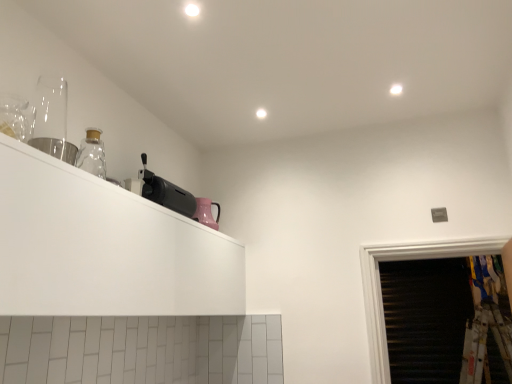
Question: Could you tell me if pink glossy kettle at upper center, which ranks as the 1th appliance in right-to-left order, is facing black plastic toaster at upper left, which is the 2th appliance in front-to-back order?

Choices:
 (A) no
 (B) yes

Answer: (A)

Question: Does pink glossy kettle at upper center, which ranks as the 1th appliance in right-to-left order, contain black plastic toaster at upper left, the second appliance positioned from the back?

Choices:
 (A) no
 (B) yes

Answer: (A)

Question: From the image's perspective, is pink glossy kettle at upper center, the 3th appliance when ordered from left to right, beneath black plastic toaster at upper left, the second appliance positioned from the back?

Choices:
 (A) no
 (B) yes

Answer: (B)

Question: Is pink glossy kettle at upper center, the 3th appliance when ordered from left to right, positioned behind black plastic toaster at upper left, the 2th appliance viewed from the right?

Choices:
 (A) yes
 (B) no

Answer: (A)

Question: From the image's perspective, is pink glossy kettle at upper center, which ranks as the 1th appliance in right-to-left order, above black plastic toaster at upper left, the 2th appliance viewed from the right?

Choices:
 (A) no
 (B) yes

Answer: (A)

Question: Does pink glossy kettle at upper center, the 3th appliance when ordered from left to right, have a lesser width compared to black plastic toaster at upper left, the second appliance positioned from the back?

Choices:
 (A) no
 (B) yes

Answer: (A)

Question: Can you confirm if black plastic toaster at upper left, the second appliance positioned from the back, is positioned to the right of pink glossy kettle at upper center, which ranks as the 1th appliance in right-to-left order?

Choices:
 (A) no
 (B) yes

Answer: (A)

Question: Is black plastic toaster at upper left, which ranks as the 2th appliance in left-to-right order, further to the viewer compared to pink glossy kettle at upper center, which ranks as the 1th appliance in right-to-left order?

Choices:
 (A) yes
 (B) no

Answer: (B)

Question: Does black plastic toaster at upper left, which ranks as the 2th appliance in left-to-right order, have a smaller size compared to pink glossy kettle at upper center, the third appliance from the front?

Choices:
 (A) no
 (B) yes

Answer: (A)

Question: Are black plastic toaster at upper left, the second appliance positioned from the back, and pink glossy kettle at upper center, which ranks as the 1th appliance in right-to-left order, making contact?

Choices:
 (A) no
 (B) yes

Answer: (A)

Question: Considering the relative positions of black plastic toaster at upper left, which is the 2th appliance in front-to-back order, and pink glossy kettle at upper center, the 3th appliance when ordered from left to right, in the image provided, is black plastic toaster at upper left, which is the 2th appliance in front-to-back order, to the left of pink glossy kettle at upper center, the 3th appliance when ordered from left to right, from the viewer's perspective?

Choices:
 (A) yes
 (B) no

Answer: (A)

Question: Can you confirm if black plastic toaster at upper left, which ranks as the 2th appliance in left-to-right order, is thinner than pink glossy kettle at upper center, which is the first appliance from back to front?

Choices:
 (A) no
 (B) yes

Answer: (B)

Question: Considering the relative positions of black plastic toaster at upper left, which ranks as the 2th appliance in left-to-right order, and white matte cabinet at upper left in the image provided, is black plastic toaster at upper left, which ranks as the 2th appliance in left-to-right order, in front of white matte cabinet at upper left?

Choices:
 (A) yes
 (B) no

Answer: (B)